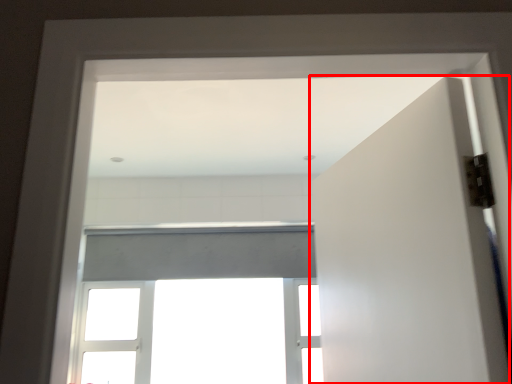
Question: From the image's perspective, what is the correct spatial positioning of door (annotated by the red box) in reference to window?

Choices:
 (A) below
 (B) above

Answer: (B)